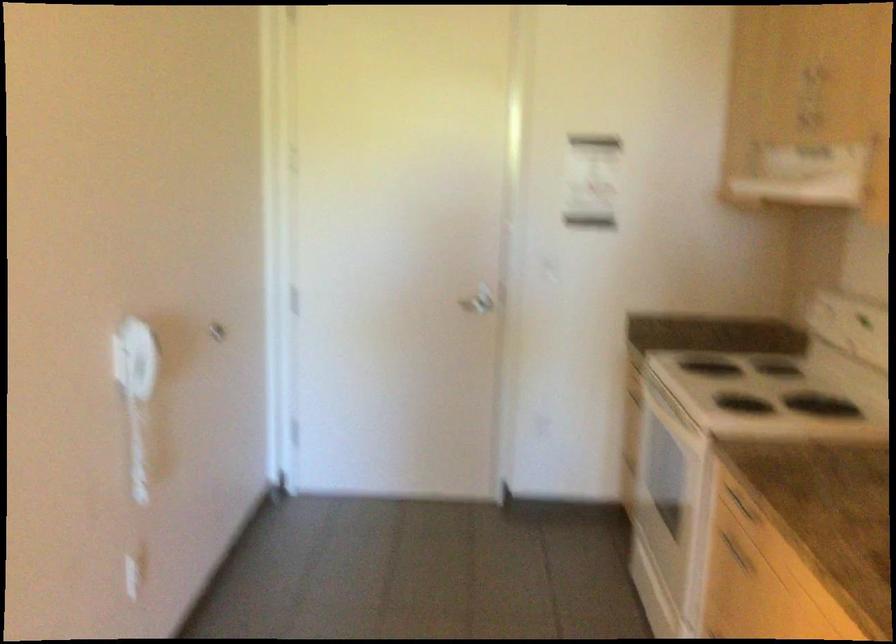
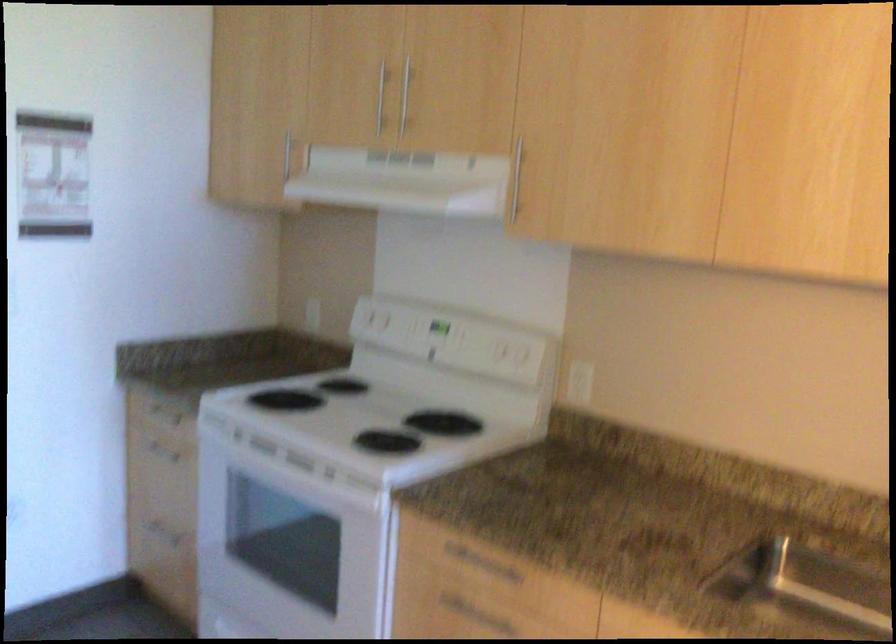
Locate, in the second image, the point that corresponds to the point at 750,507 in the first image.

(480, 564)